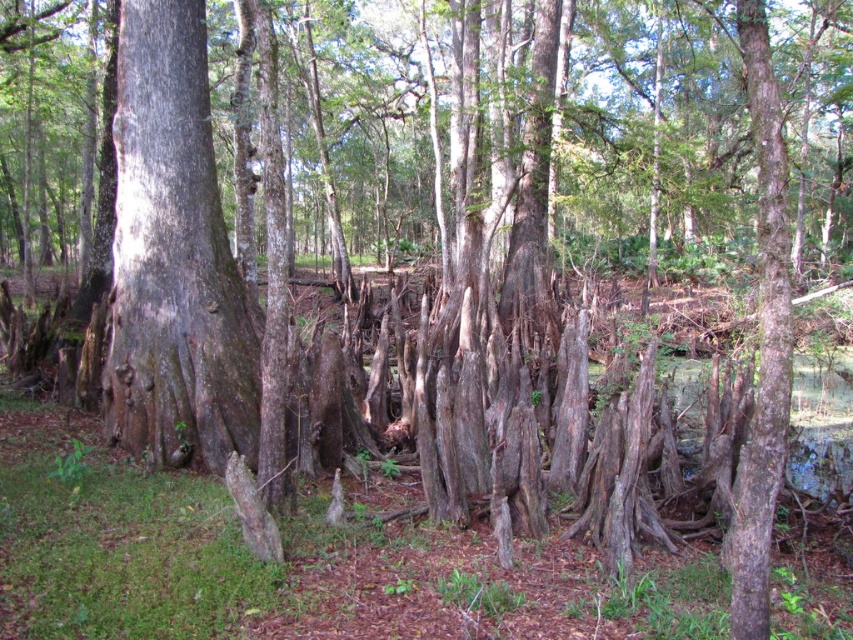
Is smooth gray bark at center to the right of smooth bark tree trunk at right from the viewer's perspective?

In fact, smooth gray bark at center is to the left of smooth bark tree trunk at right.

Looking at this image, between smooth gray bark at center and smooth bark tree trunk at right, which one has less height?

smooth bark tree trunk at right is shorter.

What do you see at coordinates (173, 257) in the screenshot?
I see `smooth gray bark at center` at bounding box center [173, 257].

Identify the location of smooth gray bark at center. (173, 257).